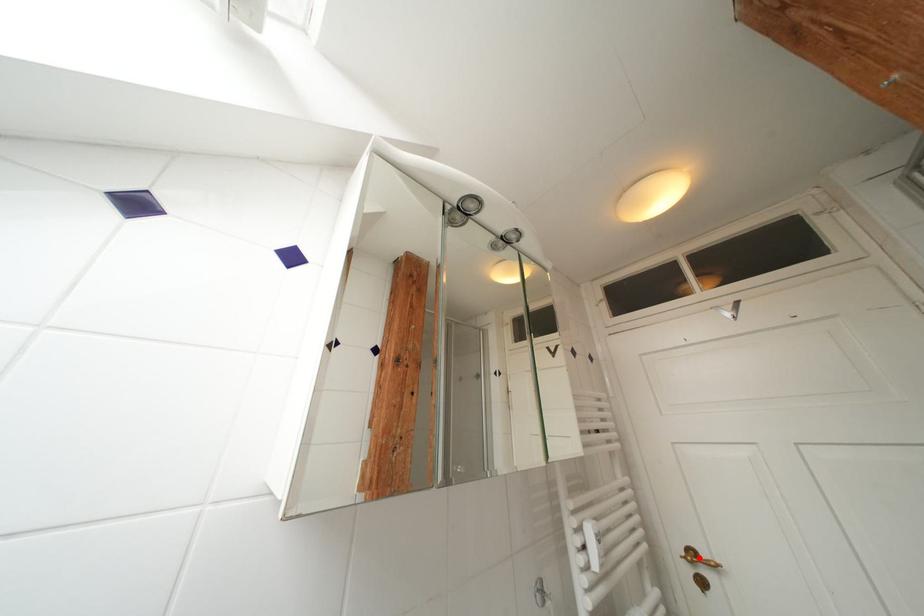
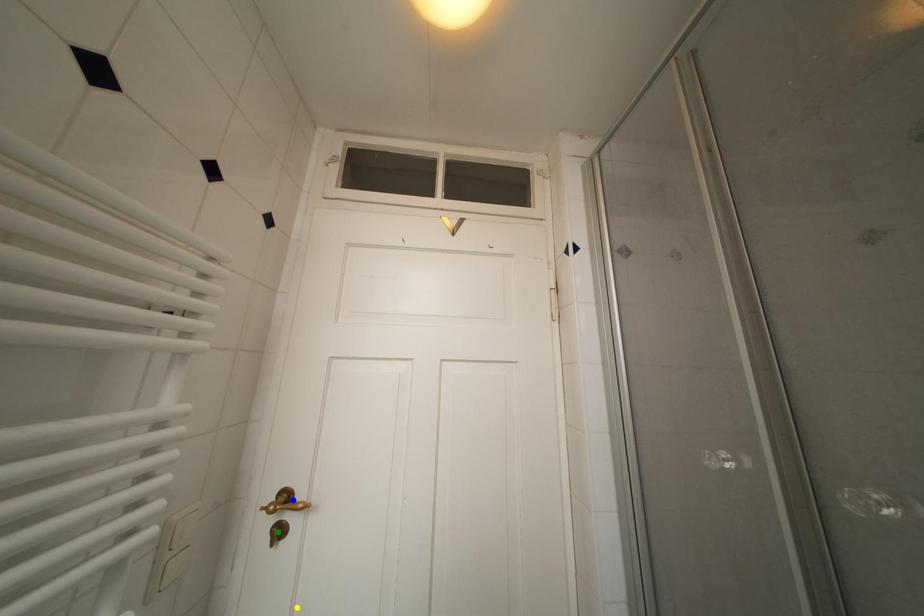
Question: I am providing you with two images of the same scene from different viewpoints. A red point is marked on the first image. You are given multiple points on the second image. Which mark in image 2 goes with the point in image 1?

Choices:
 (A) green point
 (B) yellow point
 (C) blue point

Answer: (C)